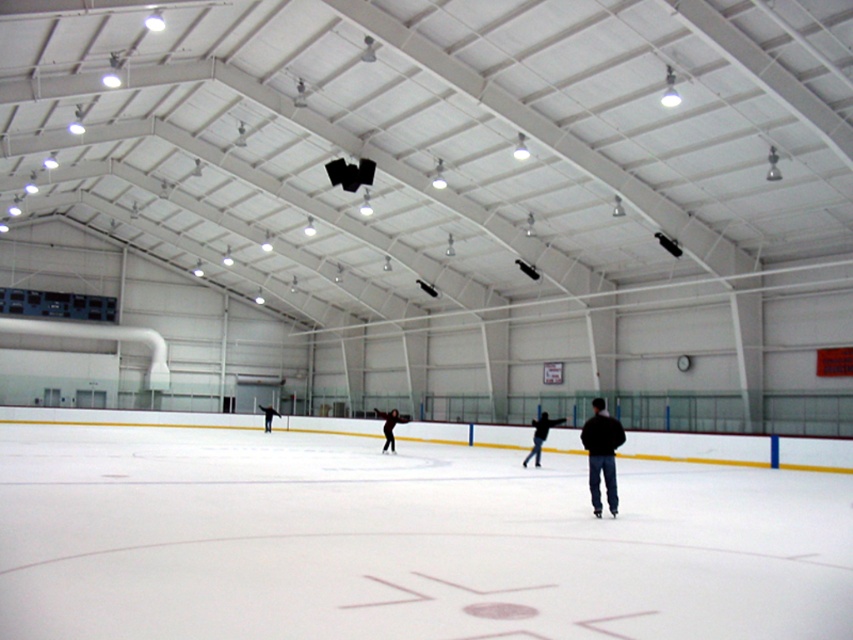
You are standing at point (270, 413) and want to move to the center of the ice rink. There is a person skating at point (569, 512). Which direction should you move to avoid them?

Since point (569, 512) is in front of point (270, 413), you should move to the side or behind the person at point (569, 512) to avoid them while heading towards the center.